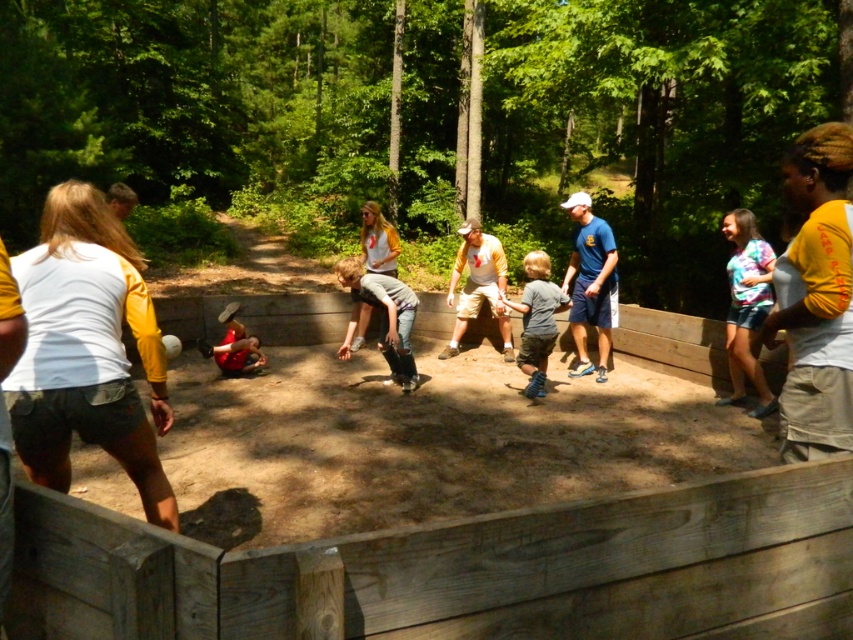
Question: Does tie-dye shirt at right have a greater width compared to gray denim jeans at center?

Choices:
 (A) no
 (B) yes

Answer: (A)

Question: Is yellow long-sleeve shirt at right below gray denim jeans at center?

Choices:
 (A) yes
 (B) no

Answer: (B)

Question: Considering the relative positions of gray denim jeans at center and gray matte shirt at center in the image provided, where is gray denim jeans at center located with respect to gray matte shirt at center?

Choices:
 (A) above
 (B) below

Answer: (B)

Question: Which point is closer to the camera?

Choices:
 (A) (582, 344)
 (B) (498, 268)

Answer: (A)

Question: Which object is the closest to the red fabric child at center?

Choices:
 (A) gray matte shirt at center
 (B) tie-dye shirt at right

Answer: (A)

Question: Considering the real-world distances, which object is closest to the gray matte shirt at center?

Choices:
 (A) red fabric child at center
 (B) gray denim jeans at center
 (C) yellow/white jersey at center
 (D) tie-dye shirt at right

Answer: (C)